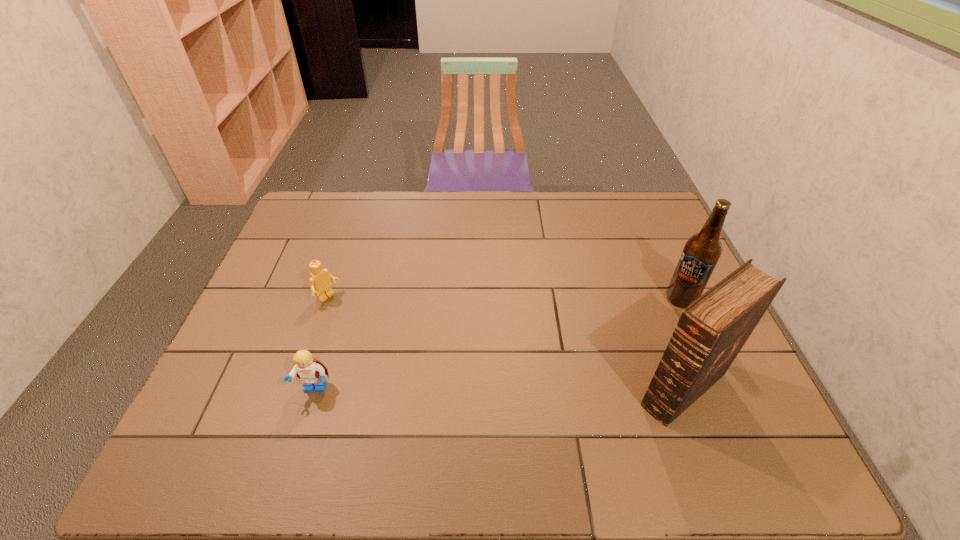
Where is `unoccupied position between the beer bottle and the nearer Lego`? The height and width of the screenshot is (540, 960). unoccupied position between the beer bottle and the nearer Lego is located at coordinates (498, 344).

Locate an element on the screen. This screenshot has width=960, height=540. object that ranks as the closest to the farther Lego is located at coordinates (310, 371).

At what (x,y) coordinates should I click in order to perform the action: click on the second closest object relative to the beer bottle. Please return your answer as a coordinate pair (x, y). Image resolution: width=960 pixels, height=540 pixels. Looking at the image, I should click on (310, 371).

In order to click on free point that satisfies the following two spatial constraints: 1. on the front-facing side of the nearer Lego; 2. on the right side of the Bible in this screenshot , I will do `click(315, 389)`.

At what (x,y) coordinates should I click in order to perform the action: click on vacant space that satisfies the following two spatial constraints: 1. on the front side of the beer bottle; 2. on the right side of the farther Lego. Please return your answer as a coordinate pair (x, y). The image size is (960, 540). Looking at the image, I should click on (327, 299).

I want to click on vacant region that satisfies the following two spatial constraints: 1. on the front-facing side of the nearer Lego; 2. on the left side of the Bible, so click(315, 389).

This screenshot has width=960, height=540. Identify the location of free space that satisfies the following two spatial constraints: 1. on the front-facing side of the Bible; 2. on the left side of the nearer Lego. (315, 389).

Where is `free location that satisfies the following two spatial constraints: 1. on the front-facing side of the nearer Lego; 2. on the right side of the Bible`? This screenshot has height=540, width=960. free location that satisfies the following two spatial constraints: 1. on the front-facing side of the nearer Lego; 2. on the right side of the Bible is located at coordinates (315, 389).